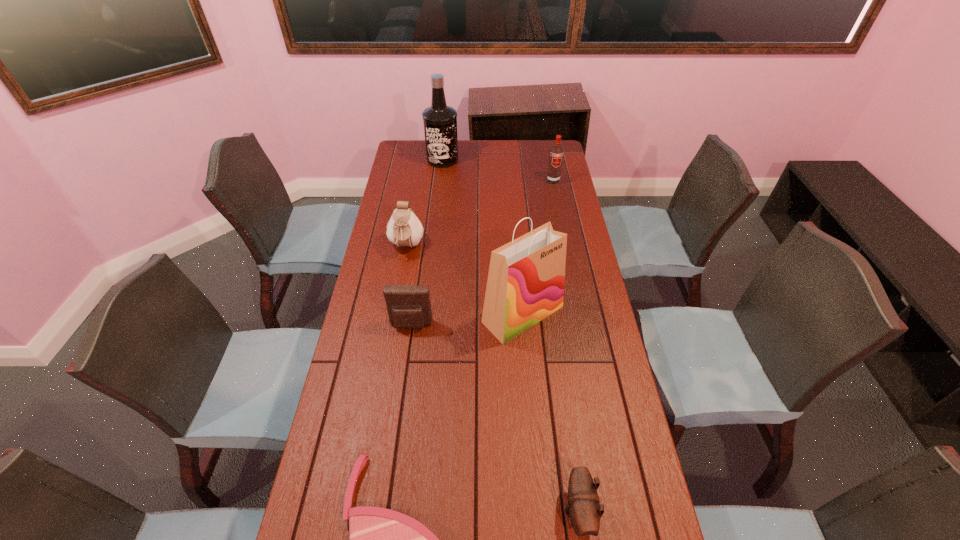
Where is `free space that satisfies the following two spatial constraints: 1. on the front label of the farthest object; 2. on the right side of the shopping bag`? The width and height of the screenshot is (960, 540). free space that satisfies the following two spatial constraints: 1. on the front label of the farthest object; 2. on the right side of the shopping bag is located at coordinates [x=425, y=314].